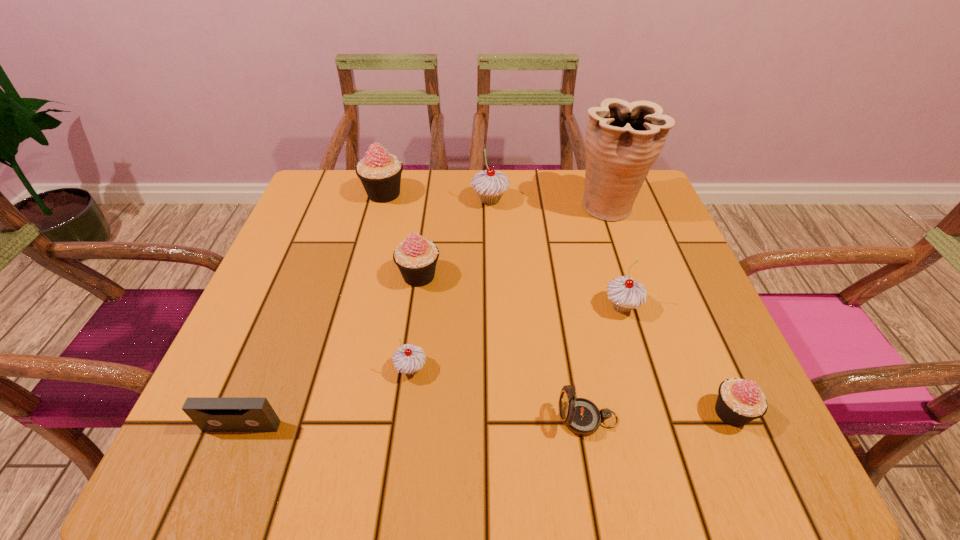
This screenshot has height=540, width=960. I want to click on free spot between the fifth nearest object and the second farthest pink cupcake, so click(x=520, y=291).

Image resolution: width=960 pixels, height=540 pixels. I want to click on vacant space in between the second gray cupcake from left to right and the second biggest gray cupcake, so click(556, 253).

At what (x,y) coordinates should I click in order to perform the action: click on vacant area that lies between the farthest pink cupcake and the sixth object from left to right. Please return your answer as a coordinate pair (x, y). Looking at the image, I should click on (486, 306).

Locate an element on the screen. blank region between the compass and the fifth nearest object is located at coordinates 605,362.

You are a GUI agent. You are given a task and a screenshot of the screen. Output one action in this format:
    pyautogui.click(x=<x>, y=<y>)
    Task: Click on the object that is the second nearest to the fifth cupcake from left to right
    The image size is (960, 540).
    Given the screenshot: What is the action you would take?
    pyautogui.click(x=581, y=416)

Locate which object is the fourth closest to the rightmost gray cupcake. Please provide its 2D coordinates. Your answer should be formatted as a tuple, i.e. [(x, y)], where the tuple contains the x and y coordinates of a point satisfying the conditions above.

[(490, 185)]

Where is `cupcake object that ranks as the closest to the videotape`? This screenshot has height=540, width=960. cupcake object that ranks as the closest to the videotape is located at coordinates (408, 359).

You are a GUI agent. You are given a task and a screenshot of the screen. Output one action in this format:
    pyautogui.click(x=<x>, y=<y>)
    Task: Click on the cupcake that is the fourth closest to the fourth farthest object
    Image resolution: width=960 pixels, height=540 pixels.
    Given the screenshot: What is the action you would take?
    pyautogui.click(x=625, y=293)

At what (x,y) coordinates should I click in order to perform the action: click on gray cupcake that is the second closest to the eighth object from right to left. Please return your answer as a coordinate pair (x, y). Looking at the image, I should click on (408, 359).

This screenshot has width=960, height=540. Identify the location of the second closest gray cupcake to the rightmost gray cupcake. (408, 359).